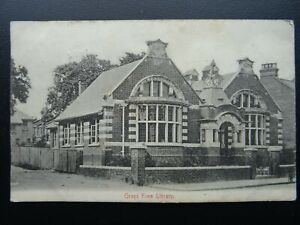
Identify the location of apartment. Image resolution: width=300 pixels, height=225 pixels. (32, 132).